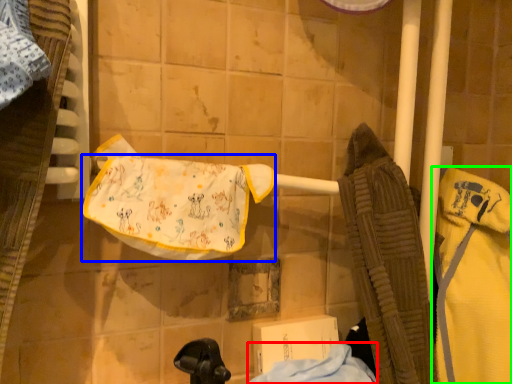
Question: Estimate the real-world distances between objects in this image. Which object is closer to cloth (highlighted by a red box), underclothes (highlighted by a blue box) or bathrobe (highlighted by a green box)?

Choices:
 (A) underclothes
 (B) bathrobe

Answer: (B)